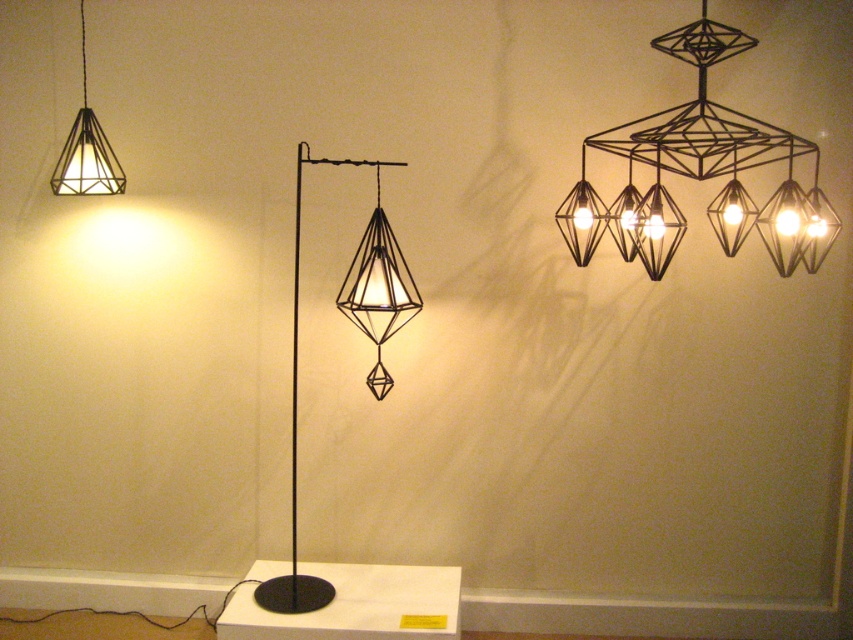
You are an interior designer planning to install two light fixtures in a small room. You have the black wireframe chandelier at upper right and the matte black geometric lamp at upper left. Considering their sizes, which one would you recommend placing closer to the center of the room to avoid overcrowding?

The matte black geometric lamp at upper left is smaller in width compared to the black wireframe chandelier at upper right, so placing it closer to the center would help prevent overcrowding in the small room.

You are an interior designer planning to place a 30 inch wide sofa between the black wireframe chandelier at upper right and the matte black floor lamp at center. Based on the spacing between these two objects, will the sofa fit comfortably in the space?

The distance between the black wireframe chandelier at upper right and the matte black floor lamp at center is 29.06 inches. Since the sofa is 30 inches wide, it will not fit comfortably as the space is slightly narrower than the sofa.

You are standing in front of the display of modern geometric light fixtures. There are two points marked in the image. The first point is at coordinate point (669, 144) and the second point is at coordinate point (347, 307). Which point is closer to you?

Point (669, 144) is closer to the camera than point (347, 307).